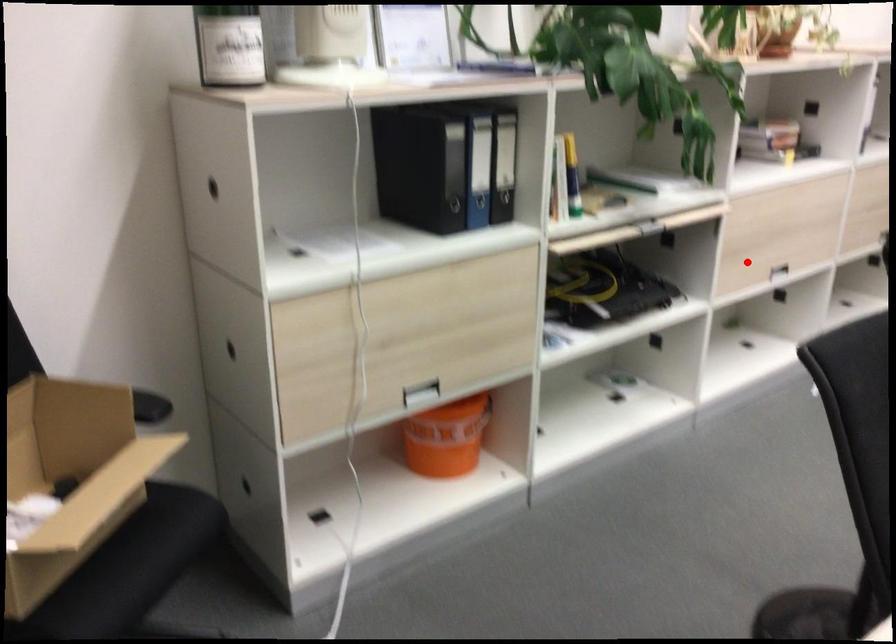
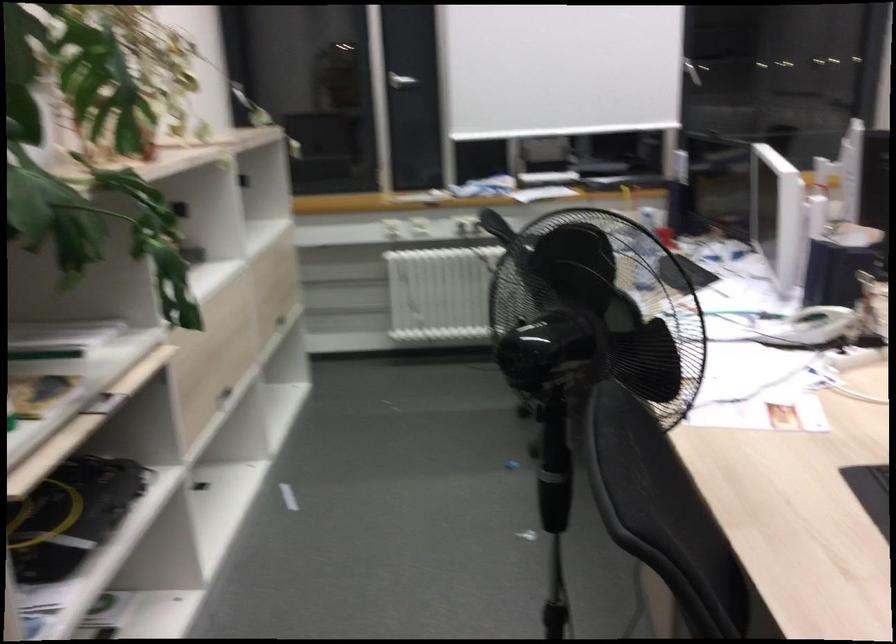
Locate, in the second image, the point that corresponds to the highlighted location in the first image.

(211, 395)